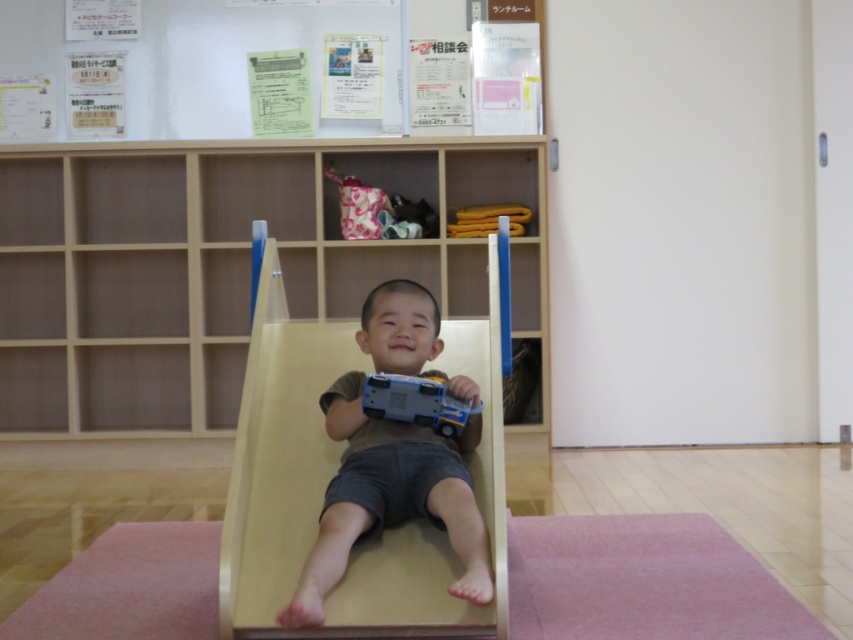
You are a parent trying to clean up the play area. You need to place a toy car that is 15 cm long. The pink carpet at lower center and the light brown wooden slide at center are in the way. Which object should you move to make space?

The pink carpet at lower center is positioned under the light brown wooden slide at center, so you should move the pink carpet at lower center to create space for the toy car.

You are standing in the room and want to place a 3 meter long toy train on the floor. The toy train needs to be placed in a straight line from the pink carpet at lower center towards the wall. Is there enough space for the toy train to fit without bending?

The pink carpet at lower center is 2.50 meters from the viewer. Since the toy train is 3 meters long, it would require more space than available. Therefore, the toy train cannot be placed straight without bending.